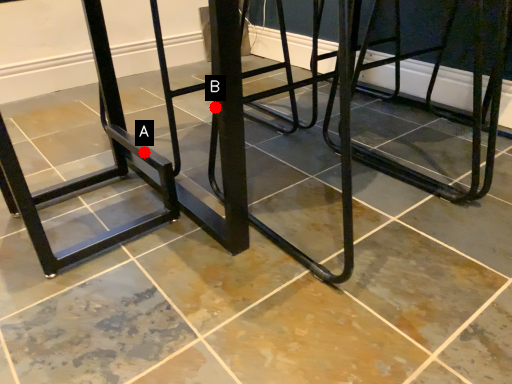
Question: Two points are circled on the image, labeled by A and B beside each circle. Which point appears farthest from the camera in this image?

Choices:
 (A) A is further
 (B) B is further

Answer: (A)